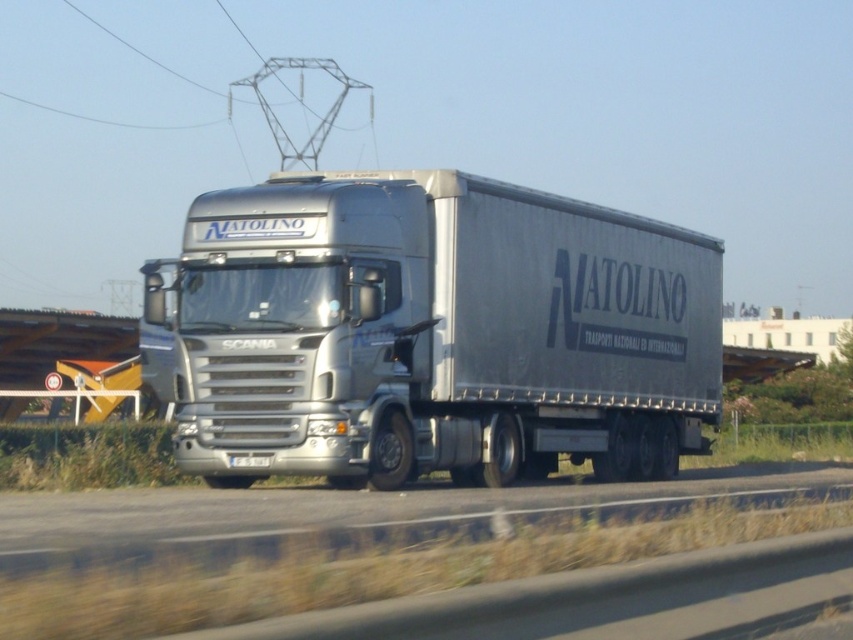
Between point (393, 444) and point (519, 512), which one is positioned behind?

Positioned behind is point (393, 444).

The image size is (853, 640). What are the coordinates of `silver metallic trailer truck at center` in the screenshot? It's located at (431, 332).